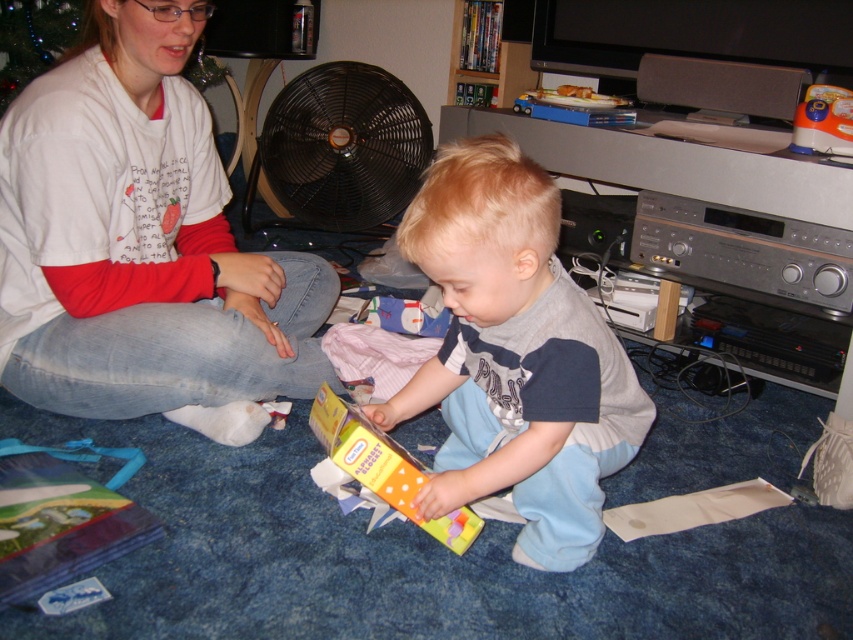
You are standing at the point labeled point (325,200) and want to move towards the point labeled point (831,132). According to the scene, will you be moving forward or backward?

Since point (325,200) is behind point (831,132), moving towards point (831,132) from point (325,200) would require moving forward.

You are a delivery person who needs to place a new rectangular package that is 1 meter wide between the black plastic fan at upper center and the orange plastic toy at upper right. Based on the scene, can you fit the package between them without moving either object?

The black plastic fan at upper center might be wider than the orange plastic toy at upper right, but since the package is 1 meter wide and the exact width of the fan and toy aren not specified, it is uncertain whether the space between them can accommodate the package. Further measurements are needed.